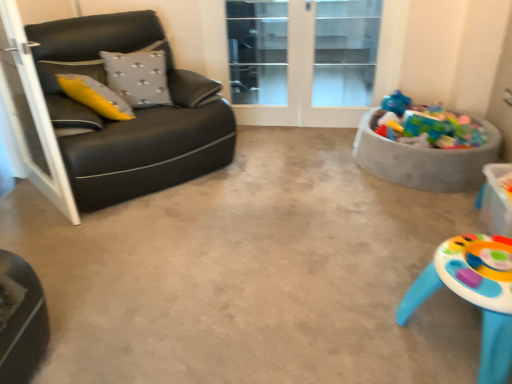
Where is `free space between black leather couch at left, which is counted as the 2th screen door, starting from the back, and matte plastic table at lower right`? This screenshot has width=512, height=384. free space between black leather couch at left, which is counted as the 2th screen door, starting from the back, and matte plastic table at lower right is located at coordinates (255, 266).